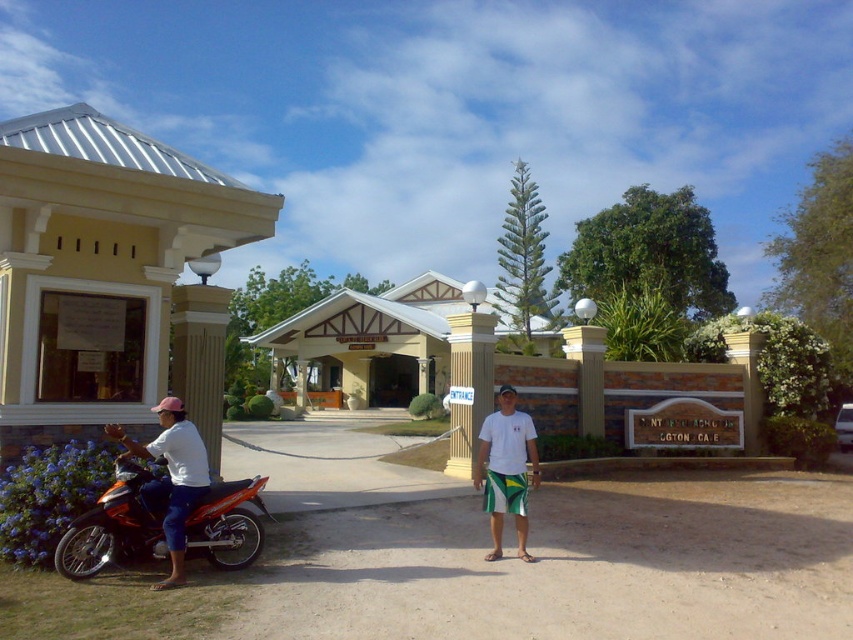
Question: Based on their relative distances, which object is nearer to the shiny orange motorcycle at left?

Choices:
 (A) yellow matte building at center
 (B) white cotton t-shirt at center
 (C) beige concrete kiosk at left
 (D) white cotton shirt at left

Answer: (D)

Question: Which object is positioned closest to the white cotton shirt at left?

Choices:
 (A) white cotton t-shirt at center
 (B) shiny orange motorcycle at left
 (C) beige concrete kiosk at left
 (D) yellow matte building at center

Answer: (B)

Question: Is beige concrete kiosk at left bigger than white cotton shirt at left?

Choices:
 (A) yes
 (B) no

Answer: (A)

Question: Which object appears closest to the camera in this image?

Choices:
 (A) beige concrete kiosk at left
 (B) white cotton shirt at left
 (C) shiny orange motorcycle at left

Answer: (B)

Question: Does shiny orange motorcycle at left have a greater width compared to white cotton t-shirt at center?

Choices:
 (A) no
 (B) yes

Answer: (B)

Question: Does beige concrete kiosk at left appear under white cotton shirt at left?

Choices:
 (A) no
 (B) yes

Answer: (A)